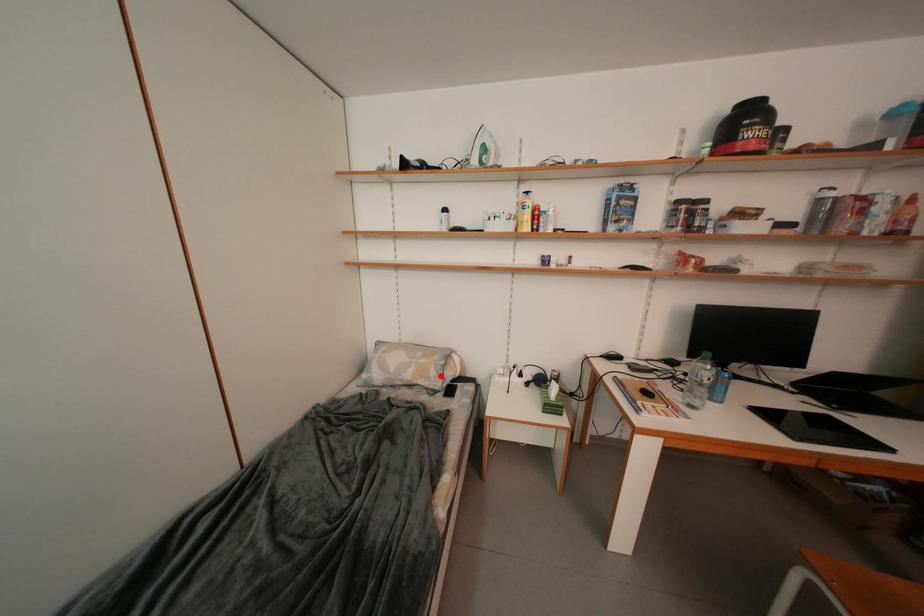
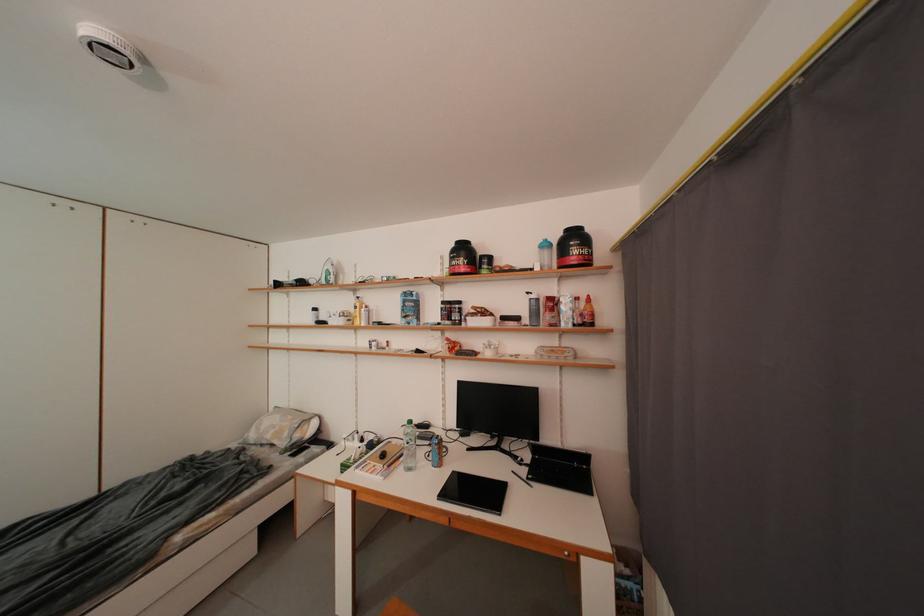
Locate, in the second image, the point that corresponds to the highlighted location in the first image.

(294, 438)